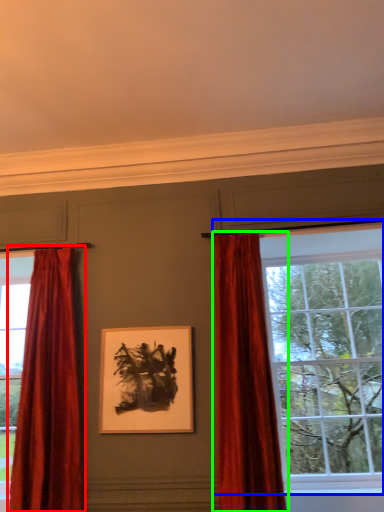
Question: Which is farther away from curtain (highlighted by a red box)? window (highlighted by a blue box) or curtain (highlighted by a green box)?

Choices:
 (A) window
 (B) curtain

Answer: (A)